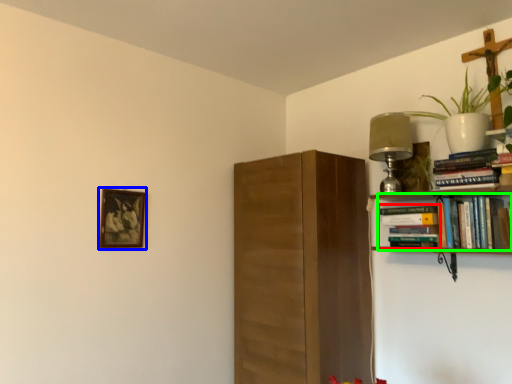
Question: Which object is positioned farthest from book (highlighted by a red box)? Select from picture frame (highlighted by a blue box) and book (highlighted by a green box).

Choices:
 (A) picture frame
 (B) book

Answer: (A)